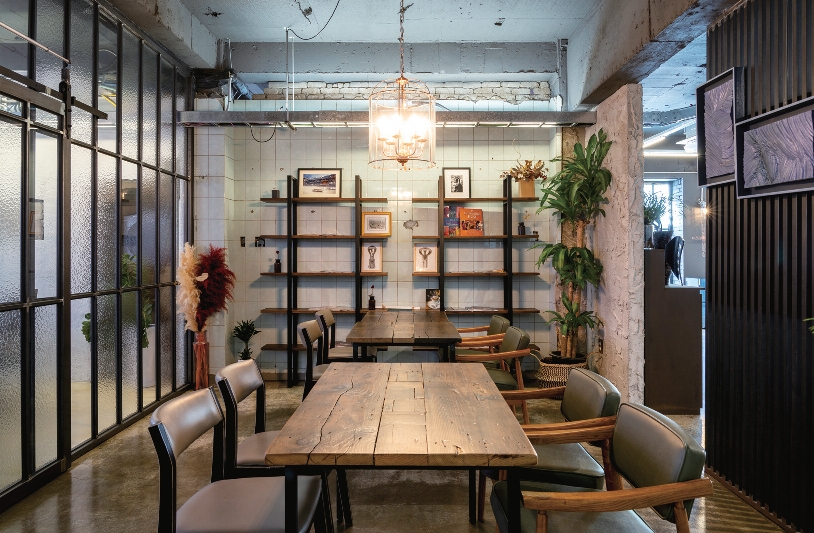
Locate an element on the screen. shelves is located at coordinates (493, 199), (497, 236), (489, 274), (497, 313), (539, 348), (281, 349), (278, 316), (289, 276), (283, 239), (283, 201).